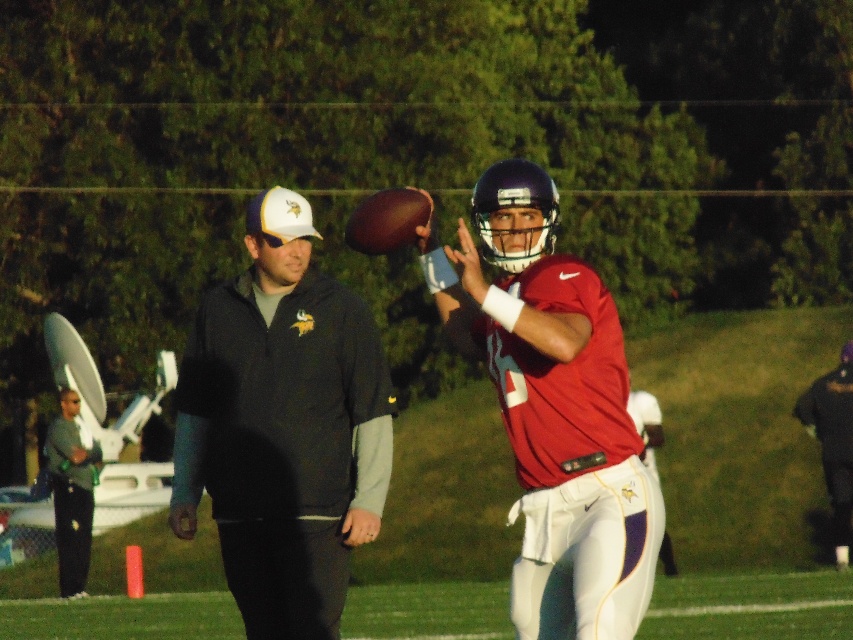
Question: Which is farther from the matte red jersey at center?

Choices:
 (A) green fabric jacket at left
 (B) dark gray hoodie at left

Answer: (A)

Question: Is dark gray hoodie at left below matte red jersey at center?

Choices:
 (A) no
 (B) yes

Answer: (B)

Question: Is matte red jersey at center smaller than dark blue helmet at upper center?

Choices:
 (A) no
 (B) yes

Answer: (A)

Question: Which point is closer to the camera taking this photo?

Choices:
 (A) (312, 276)
 (B) (575, 557)

Answer: (B)

Question: Which point is farther from the camera taking this photo?

Choices:
 (A) (809, 387)
 (B) (68, 465)

Answer: (A)

Question: Can you confirm if dark gray hoodie at left is wider than green fabric jacket at left?

Choices:
 (A) no
 (B) yes

Answer: (B)